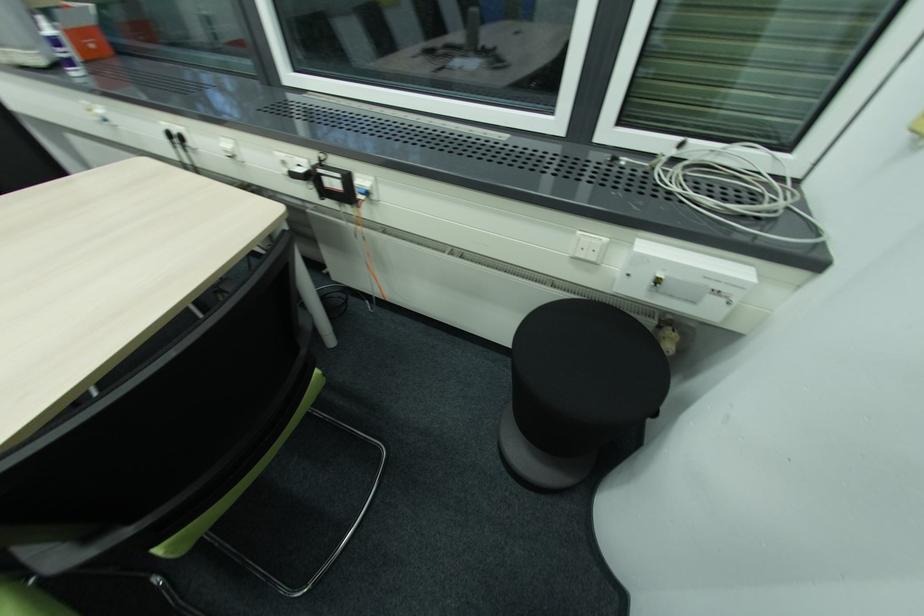
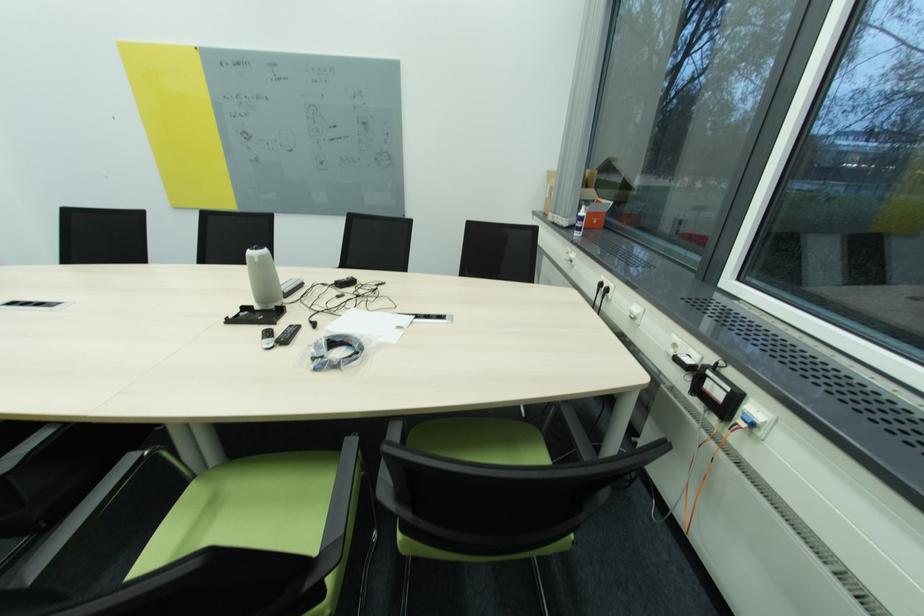
The point at (187,139) is marked in the first image. Where is the corresponding point in the second image?

(612, 291)